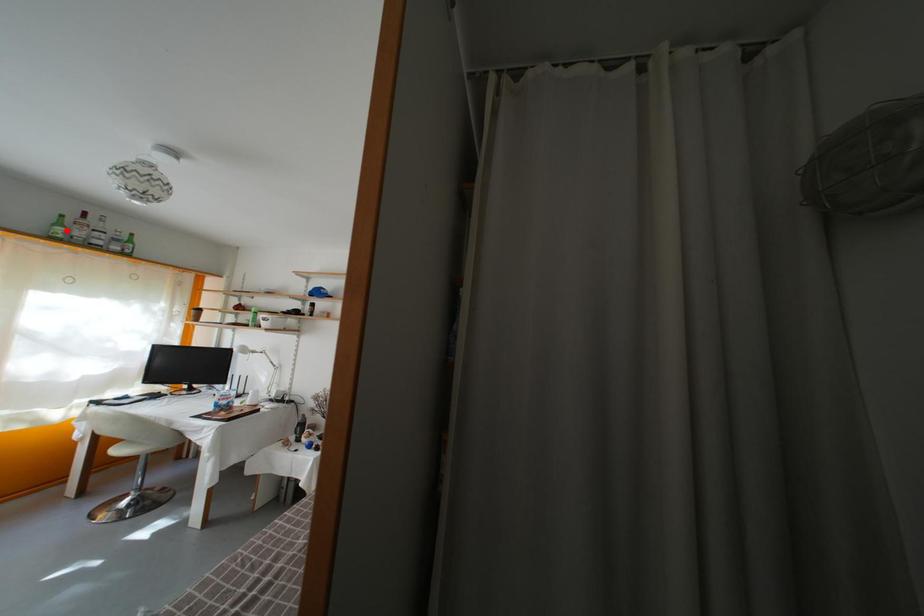
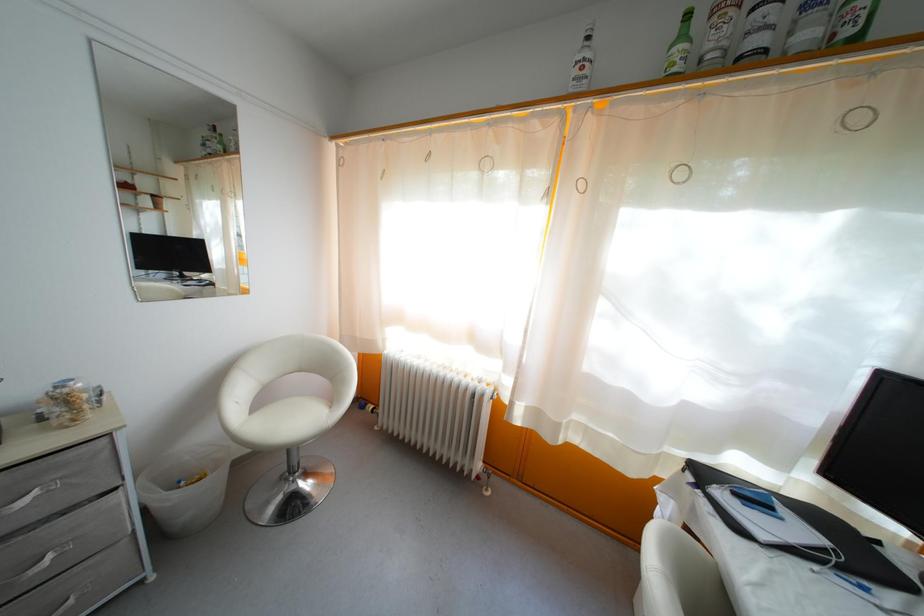
The point at the highlighted location is marked in the first image. Where is the corresponding point in the second image?

(688, 43)